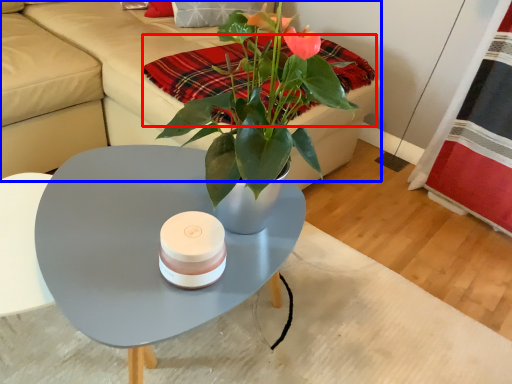
Question: Which point is closer to the camera, blanket (highlighted by a red box) or couch (highlighted by a blue box)?

Choices:
 (A) blanket
 (B) couch

Answer: (B)